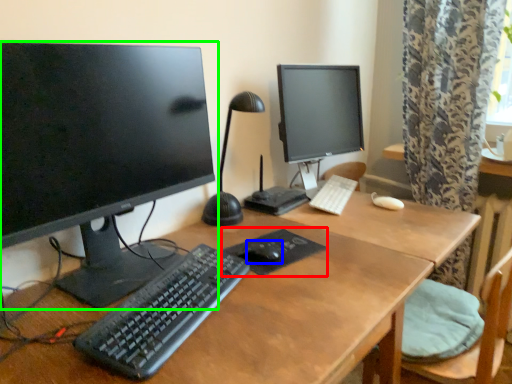
Question: Which object is the farthest from mousepad (highlighted by a red box)? Choose among these: mouse (highlighted by a blue box) or computer monitor (highlighted by a green box).

Choices:
 (A) mouse
 (B) computer monitor

Answer: (B)